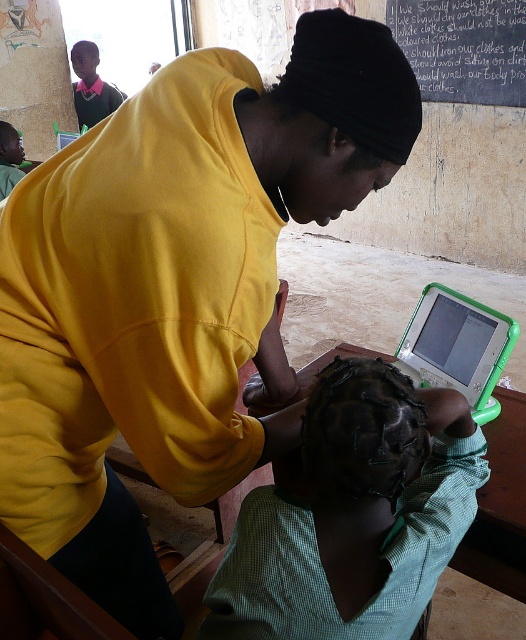
Question: Considering the real-world distances, which object is closest to the green checkered shirt at lower center?

Choices:
 (A) white chalkboard at upper center
 (B) green plastic laptop at lower right
 (C) green plastic table at lower center

Answer: (B)

Question: Which of the following is the closest to the observer?

Choices:
 (A) white chalkboard at upper center
 (B) green checkered shirt at lower center
 (C) green plastic table at lower center

Answer: (B)

Question: Does green plastic laptop at lower right lie in front of green plastic table at lower center?

Choices:
 (A) yes
 (B) no

Answer: (A)

Question: Can you confirm if green checkered shirt at lower center is smaller than green plastic table at lower center?

Choices:
 (A) no
 (B) yes

Answer: (A)

Question: Considering the relative positions of green checkered shirt at lower center and green plastic laptop at lower right in the image provided, where is green checkered shirt at lower center located with respect to green plastic laptop at lower right?

Choices:
 (A) left
 (B) right

Answer: (A)

Question: Which object is farther from the camera taking this photo?

Choices:
 (A) white chalkboard at upper center
 (B) green plastic laptop at lower right
 (C) green plastic table at lower center
 (D) green checkered shirt at lower center

Answer: (A)